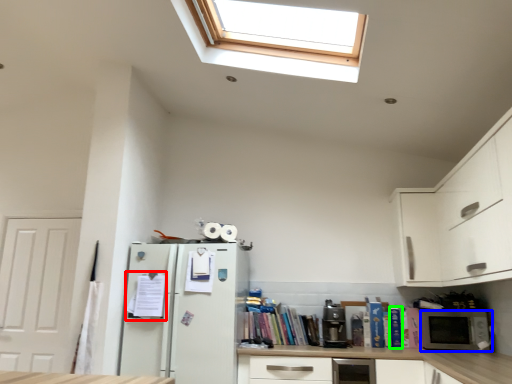
Question: Which is nearer to the book (highlighted by a red box)? microwave oven (highlighted by a blue box) or book (highlighted by a green box).

Choices:
 (A) microwave oven
 (B) book

Answer: (B)